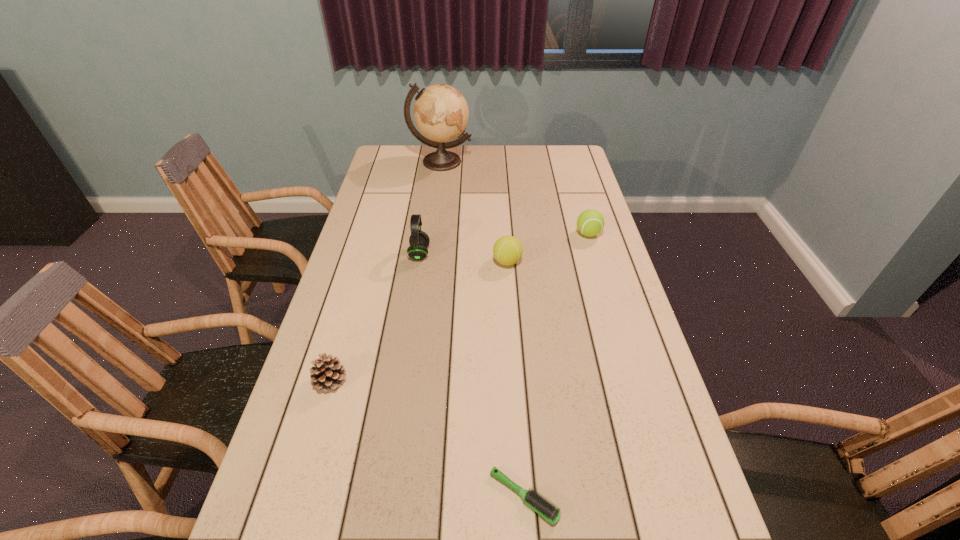
Image resolution: width=960 pixels, height=540 pixels. I want to click on vacant area that satisfies the following two spatial constraints: 1. on the front-facing side of the nearer tennis ball; 2. on the right side of the tallest object, so click(x=427, y=262).

This screenshot has width=960, height=540. I want to click on free space that satisfies the following two spatial constraints: 1. on the ear cups of the fifth shortest object; 2. on the right side of the left tennis ball, so click(x=419, y=262).